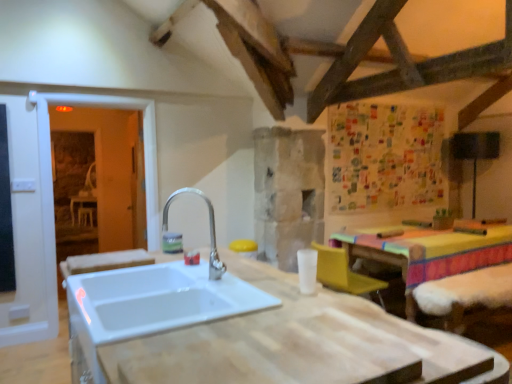
Question: Is point (353, 289) closer or farther from the camera than point (128, 311)?

Choices:
 (A) closer
 (B) farther

Answer: (B)

Question: Is yellow plastic armchair at lower right wider or thinner than white ceramic sink at center?

Choices:
 (A) thin
 (B) wide

Answer: (A)

Question: Which object is the farthest from the white wood countertop at center?

Choices:
 (A) white ceramic sink at center
 (B) yellow plastic armchair at lower right
 (C) transparent glass door at left

Answer: (C)

Question: Which object is positioned farthest from the transparent glass door at left?

Choices:
 (A) white ceramic sink at center
 (B) white wood countertop at center
 (C) yellow plastic armchair at lower right

Answer: (B)